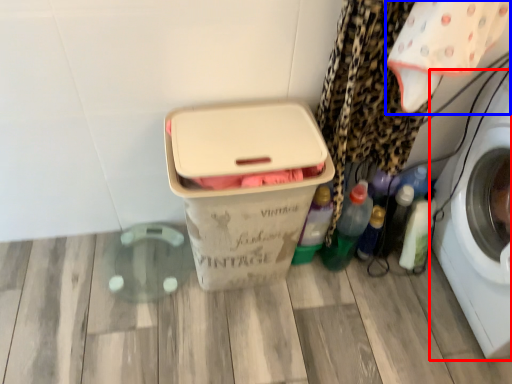
Question: Among these objects, which one is farthest to the camera, washing machine (highlighted by a red box) or baby clothe (highlighted by a blue box)?

Choices:
 (A) washing machine
 (B) baby clothe

Answer: (B)